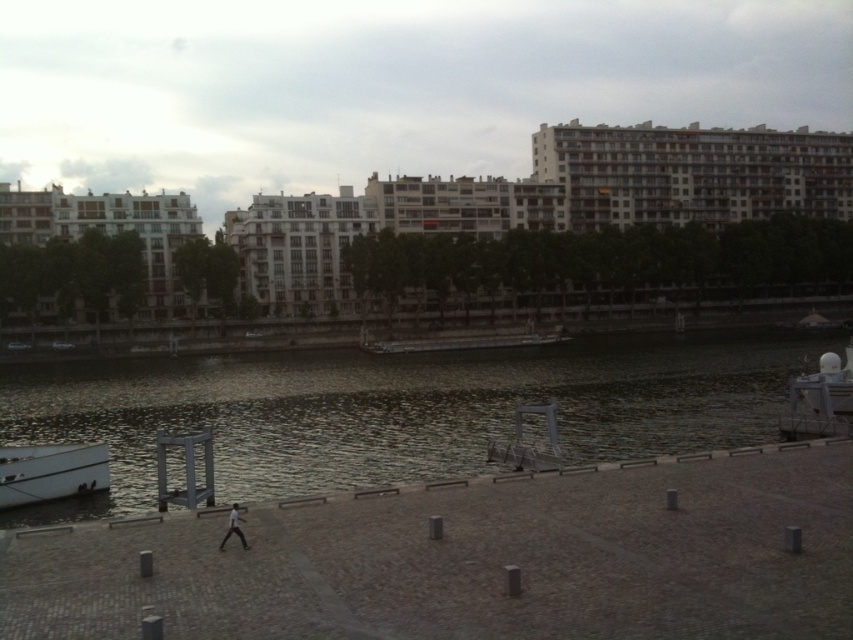
You are standing on the riverside walkway and want to cross to the other side. The dark water at center flows gently. If you can swim 2 meters per second and the current is 1 meter per second against you, how many seconds will it take to reach the other side?

The dark water at center is 22.87 meters wide. Swimming against a 1 m per second current, your effective speed is 1 m per second. Time taken is 22.87 meters divided by 1 m per second, which equals approximately 22.87 seconds.

You are a photographer planning to capture the entire scene in one shot. Given that your camera can only focus on one object at a time, which object between the dark water at center and the white matte boat at lower left should you choose to ensure the larger object is in focus?

The dark water at center is larger in size than the white matte boat at lower left, so you should focus on the dark water at center to ensure the larger object is in focus.

You are standing on the riverside walkway and want to take a photo of both the point at coordinates [62,426] and the point at coordinates [33,496]. Based on their positions, which point will appear closer to the edge of the photo frame?

Point [33,496] will appear closer to the edge of the photo frame because it is farther from the camera compared to point [62,426].